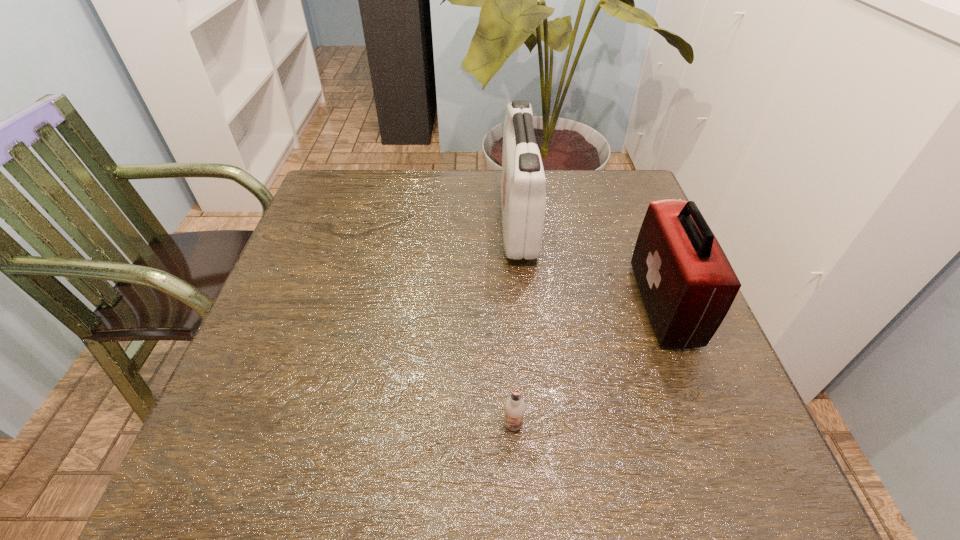
Choose which object is the nearest neighbor to the nearest object. Please provide its 2D coordinates. Your answer should be formatted as a tuple, i.e. [(x, y)], where the tuple contains the x and y coordinates of a point satisfying the conditions above.

[(687, 284)]